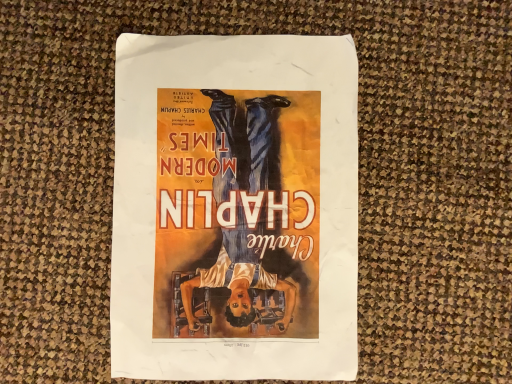
This screenshot has height=384, width=512. Describe the element at coordinates (234, 208) in the screenshot. I see `matte paper poster at center` at that location.

The width and height of the screenshot is (512, 384). I want to click on matte paper poster at center, so click(x=234, y=208).

You are a GUI agent. You are given a task and a screenshot of the screen. Output one action in this format:
    pyautogui.click(x=<x>, y=<y>)
    Task: Click on the matte paper poster at center
    The width and height of the screenshot is (512, 384).
    Given the screenshot: What is the action you would take?
    pyautogui.click(x=234, y=208)